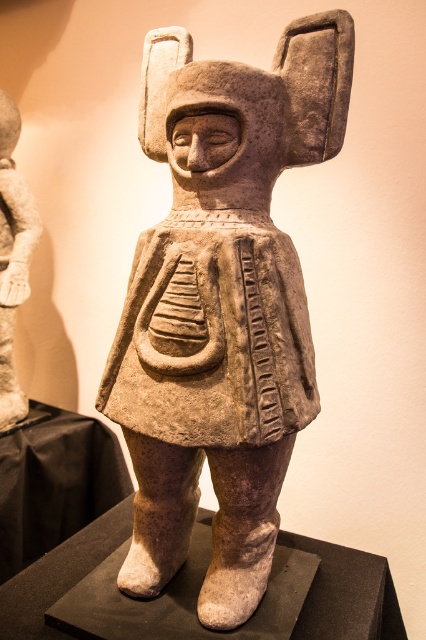
Question: Which of the following is the closest to the observer?

Choices:
 (A) (17, 179)
 (B) (161, 147)

Answer: (B)

Question: Can you confirm if stone statue at center is thinner than white matte statue at left?

Choices:
 (A) no
 (B) yes

Answer: (A)

Question: Does stone statue at center have a greater width compared to white matte statue at left?

Choices:
 (A) yes
 (B) no

Answer: (A)

Question: Can you confirm if stone statue at center is smaller than white matte statue at left?

Choices:
 (A) no
 (B) yes

Answer: (A)

Question: Which of the following is the closest to the observer?

Choices:
 (A) tap(5, 364)
 (B) tap(126, 557)

Answer: (B)